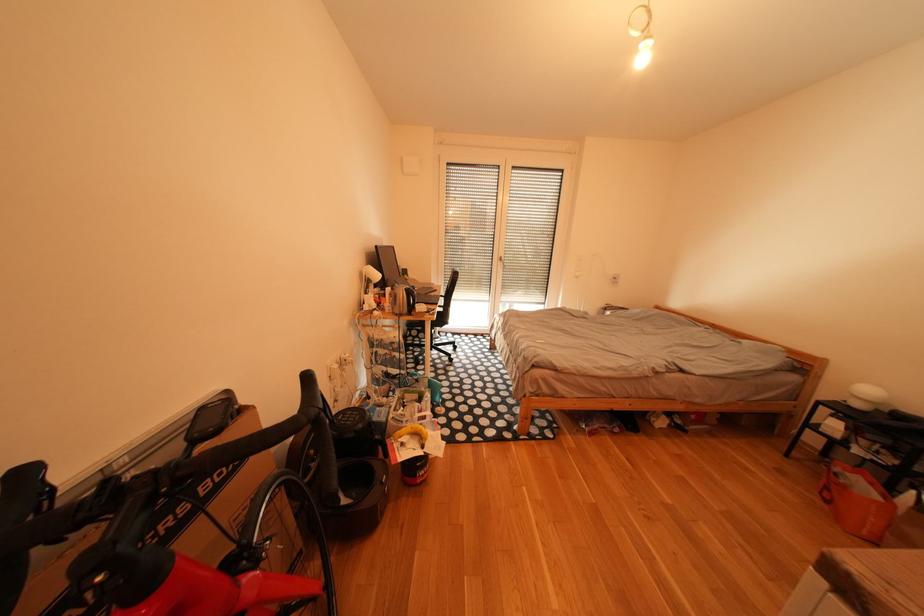
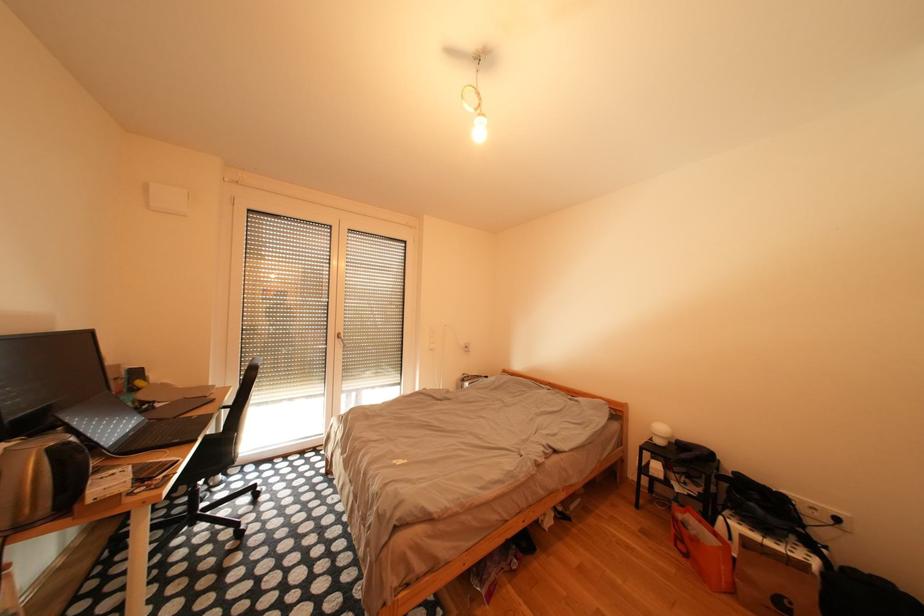
Question: The camera is either moving clockwise (left) or counter-clockwise (right) around the object. The first image is from the beginning of the video and the second image is from the end. Is the camera moving left or right when shooting the video?

Choices:
 (A) Left
 (B) Right

Answer: (A)